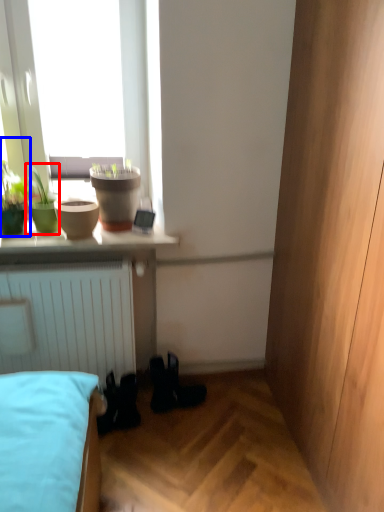
Question: Which object is further to the camera taking this photo, houseplant (highlighted by a red box) or houseplant (highlighted by a blue box)?

Choices:
 (A) houseplant
 (B) houseplant

Answer: (A)